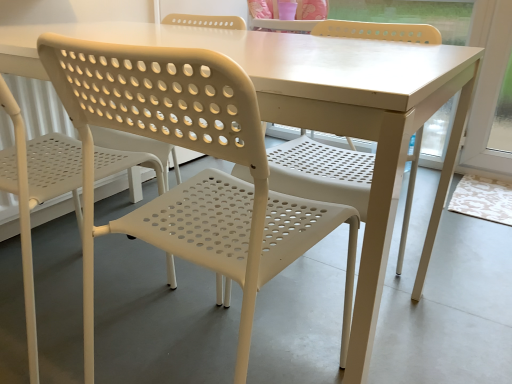
Where is `free spot to the right of white plastic chair at left, the 1th chair in the left-to-right sequence`? Image resolution: width=512 pixels, height=384 pixels. free spot to the right of white plastic chair at left, the 1th chair in the left-to-right sequence is located at coordinates (196, 315).